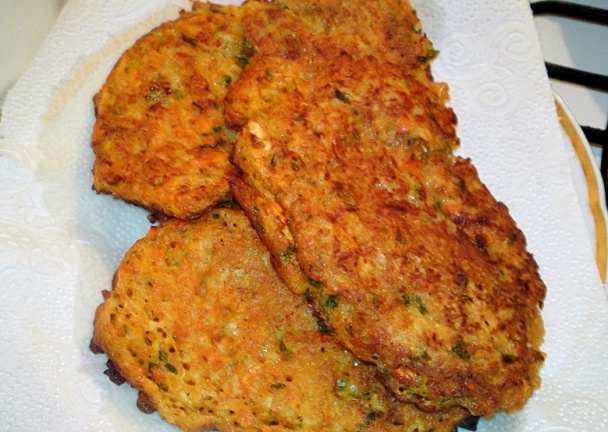
Find the location of a particular element. white table is located at coordinates (14, 16).